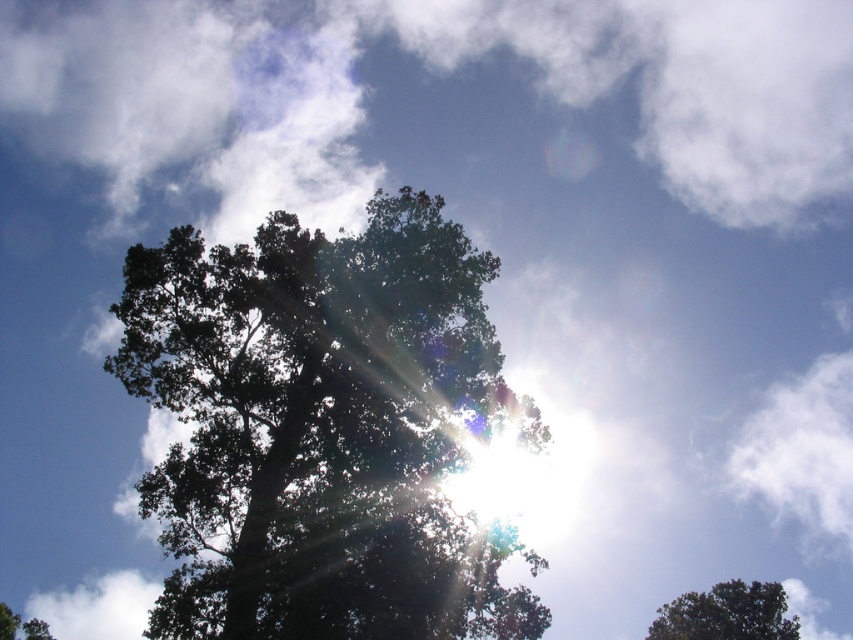
You are standing in a park and see the dark green leafy tree at center and the green leafy tree at lower right. Which tree is positioned higher in the image?

The dark green leafy tree at center is positioned higher in the image than the green leafy tree at lower right.

You are standing in a park and see the dark green leafy tree at center and the green leafy tree at lower right. Which tree is closer to the left side of the park?

The dark green leafy tree at center is closer to the left side of the park because it is positioned to the left of the green leafy tree at lower right.

You are a bird looking for a nesting spot. You see the dark green leafy tree at center and the green leafy tree at lower right. Which tree is taller and would provide a better vantage point?

The dark green leafy tree at center is taller than the green leafy tree at lower right, so it would provide a better vantage point for nesting.